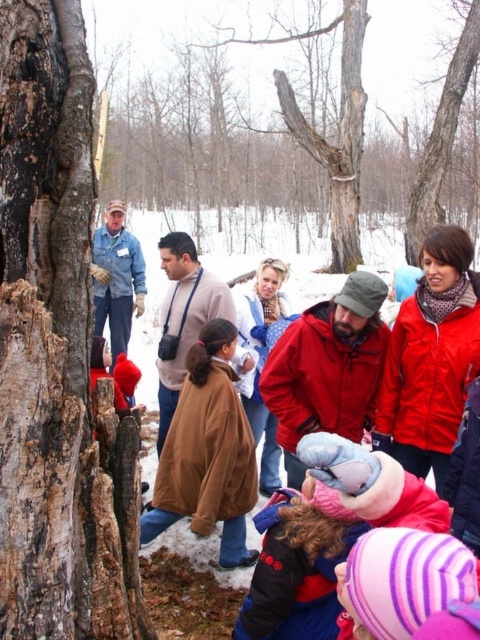
You are a hiker with a backpack measuring 0.5 meters in width. You want to pass between the brown rough bark tree trunk at left and the brown suede jacket at center. Can your backpack fit through the space between them?

The distance between the brown rough bark tree trunk at left and the brown suede jacket at center is 1.56 meters. Since your backpack is only 0.5 meters wide, it should fit comfortably through the space without any issues.

You are a hiker trying to locate the rough bark tree at center in the snowy forest. Your GPS shows a point at coordinates (300, 120). What does this point indicate?

The point at coordinates (300, 120) marks the location of the rough bark tree at center.

You are standing in the snowy forest scene and want to move from the point closer to you to the point further away. Which path would you take between the two points listed below? Please specify the starting and ending points using their coordinates. The points are point (6, 227) and point (177, 456).

The point closer to the viewer is point (6, 227), so you should start there and move towards point (177, 456), which is further away.